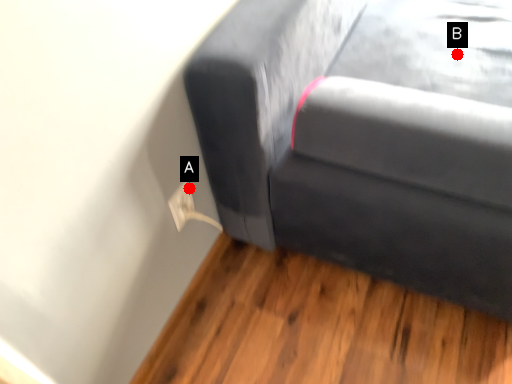
Question: Two points are circled on the image, labeled by A and B beside each circle. Which point is closer to the camera?

Choices:
 (A) A is closer
 (B) B is closer

Answer: (A)